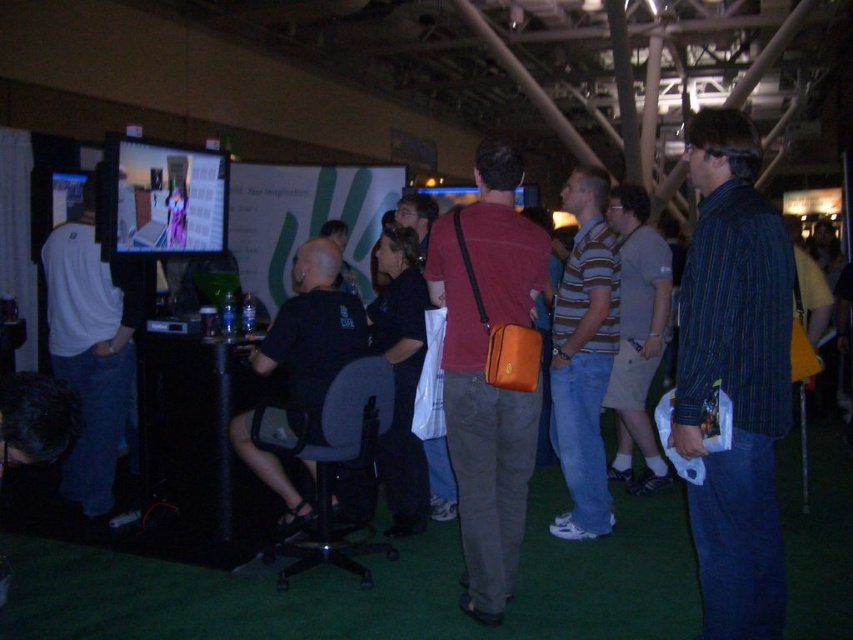
Question: Which of the following is the closest to the observer?

Choices:
 (A) striped cotton shirt at center
 (B) gray cotton t-shirt at center
 (C) black fabric shirt at center

Answer: (C)

Question: Which point is farther to the camera?

Choices:
 (A) (57, 305)
 (B) (645, 252)

Answer: (B)

Question: Does white matte shirt at left have a larger size compared to gray cotton t-shirt at center?

Choices:
 (A) yes
 (B) no

Answer: (A)

Question: Can you confirm if striped cotton shirt at right is positioned to the left of black fabric shirt at center?

Choices:
 (A) no
 (B) yes

Answer: (A)

Question: Does white matte shirt at left have a larger size compared to gray cotton t-shirt at center?

Choices:
 (A) yes
 (B) no

Answer: (A)

Question: Estimate the real-world distances between objects in this image. Which object is farther from the black fabric shirt at center?

Choices:
 (A) striped cotton shirt at center
 (B) white matte shirt at left
 (C) gray cotton t-shirt at center

Answer: (C)